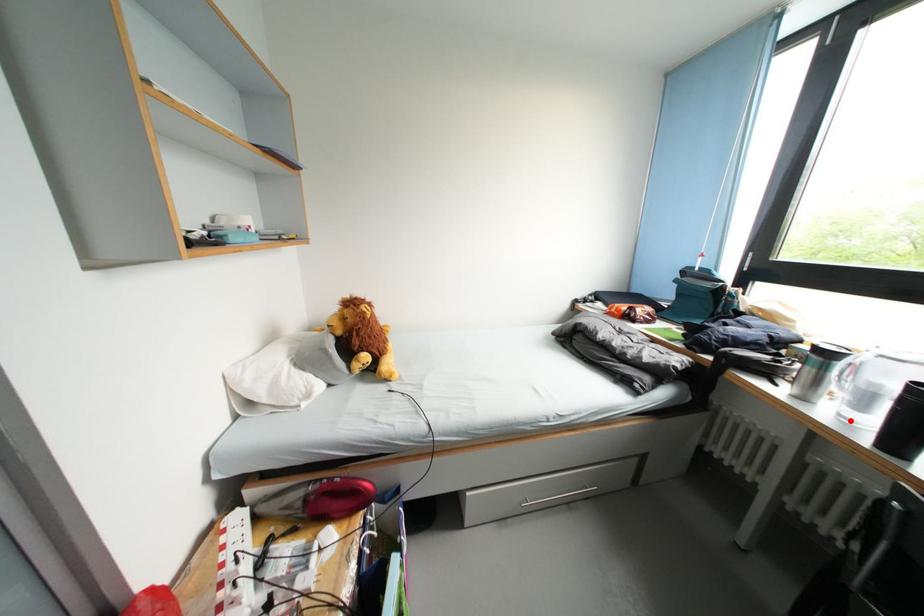
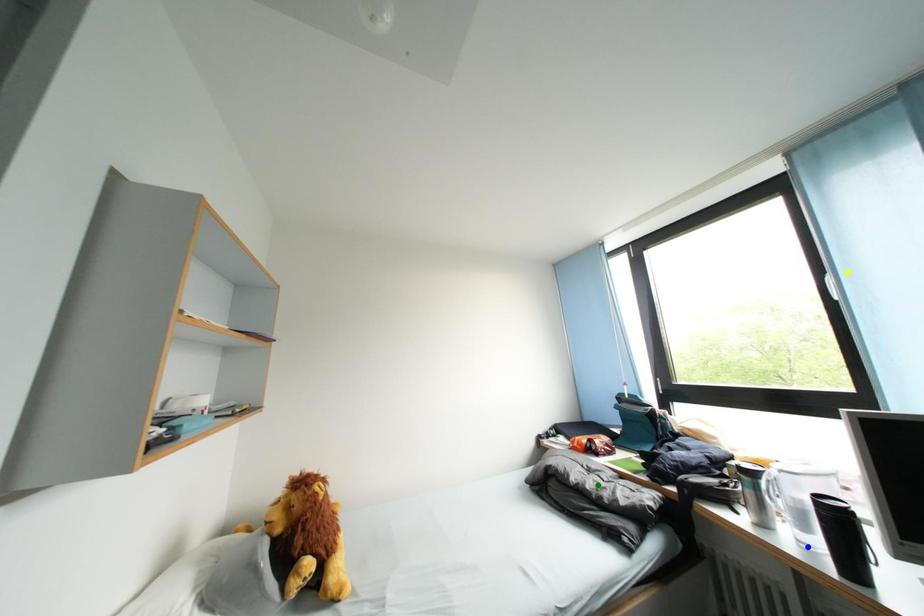
Question: I am providing you with two images of the same scene from different viewpoints. A red point is marked on the first image. You are given multiple points on the second image. In image 2, which mark is for the same physical point as the one in image 1?

Choices:
 (A) green point
 (B) blue point
 (C) yellow point

Answer: (B)